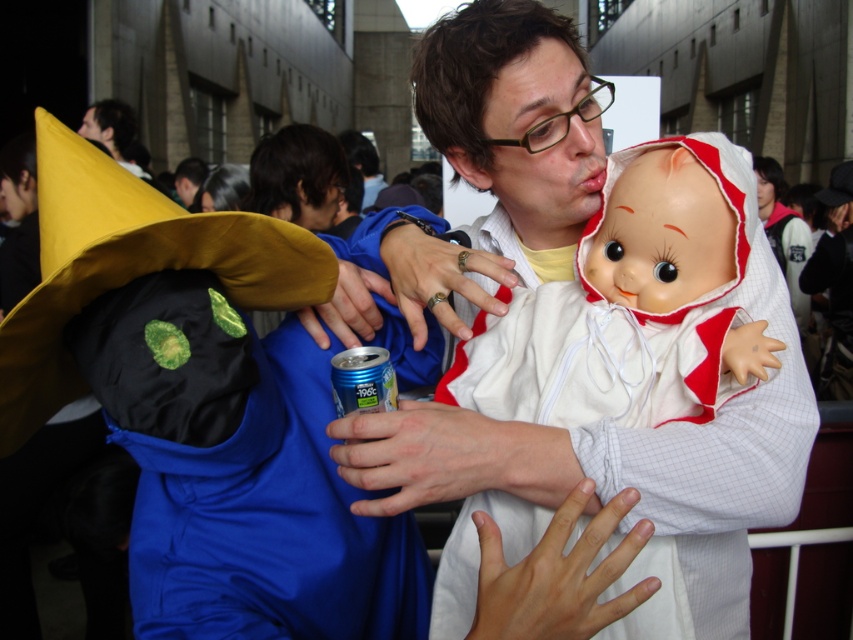
Which is more to the right, blue metallic can at center or dark brown hair at upper left?

Positioned to the right is blue metallic can at center.

How distant is blue metallic can at center from dark brown hair at upper left?

They are 4.69 meters apart.

Locate an element on the screen. blue metallic can at center is located at coordinates (363, 380).

You are a GUI agent. You are given a task and a screenshot of the screen. Output one action in this format:
    pyautogui.click(x=<x>, y=<y>)
    Task: Click on the blue metallic can at center
    This screenshot has height=640, width=853.
    Given the screenshot: What is the action you would take?
    pyautogui.click(x=363, y=380)

Which of these two, smooth plastic doll at center or dark brown hair at upper left, stands shorter?

smooth plastic doll at center

This screenshot has width=853, height=640. In order to click on smooth plastic doll at center in this screenshot , I will do `click(610, 330)`.

Does point (566, 289) lie behind point (343, 410)?

Yes, point (566, 289) is farther from viewer.

Is the position of smooth plastic doll at center less distant than that of blue metallic can at center?

Yes, smooth plastic doll at center is closer to the viewer.

Is point (592, 312) positioned in front of point (352, 362)?

No, it is not.

Where is `smooth plastic doll at center`? This screenshot has width=853, height=640. smooth plastic doll at center is located at coordinates (610, 330).